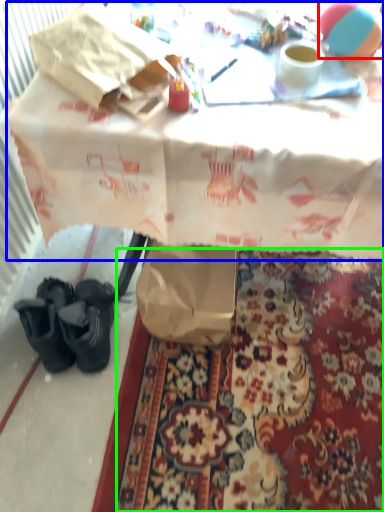
Question: Which is farther away from ball (highlighted by a red box)? table (highlighted by a blue box) or mat (highlighted by a green box)?

Choices:
 (A) table
 (B) mat

Answer: (B)